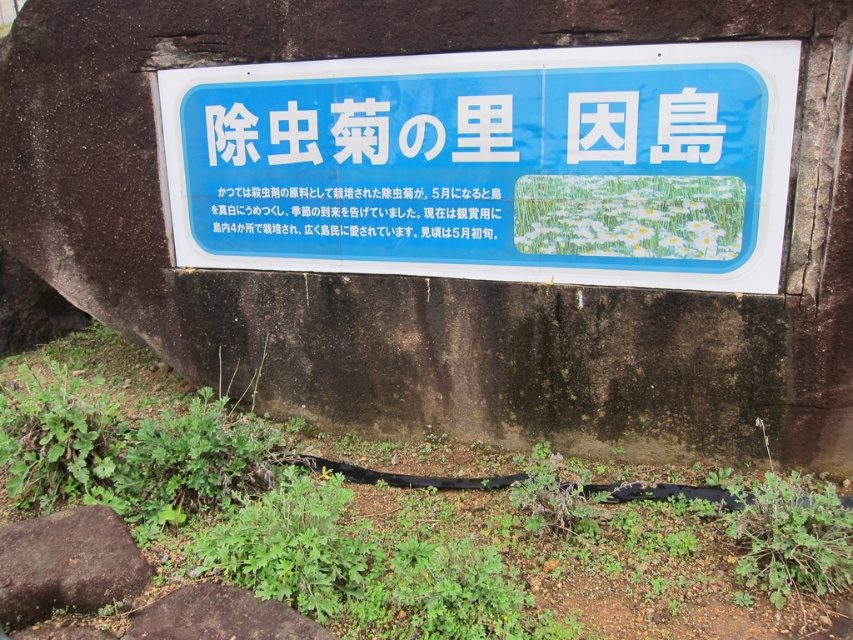
This screenshot has width=853, height=640. What do you see at coordinates (491, 164) in the screenshot?
I see `blue plastic sign at center` at bounding box center [491, 164].

Is blue plastic sign at center closer to the viewer compared to white paper text at center?

That is True.

Is point (592, 170) closer to viewer compared to point (317, 228)?

That is True.

Find the location of `blue plastic sign at center`. blue plastic sign at center is located at coordinates (491, 164).

Is point (79, 564) positioned in front of point (474, 216)?

Yes, it is.

Does point (146, 570) come behind point (415, 205)?

No, (146, 570) is in front of (415, 205).

At what (x,y) coordinates should I click in order to perform the action: click on brown rough rock at lower left. Please return your answer as a coordinate pair (x, y). Looking at the image, I should click on (67, 563).

Where is `brown rough rock at lower left`? The image size is (853, 640). brown rough rock at lower left is located at coordinates (67, 563).

From the picture: Which is below, brown rough rock at lower left or brown rough stone at lower center?

brown rough stone at lower center is lower down.

Is brown rough rock at lower left to the left of brown rough stone at lower center from the viewer's perspective?

Indeed, brown rough rock at lower left is positioned on the left side of brown rough stone at lower center.

Which is behind, point (21, 611) or point (213, 628)?

The point (21, 611) is more distant.

Locate an element on the screen. This screenshot has width=853, height=640. brown rough rock at lower left is located at coordinates pos(67,563).